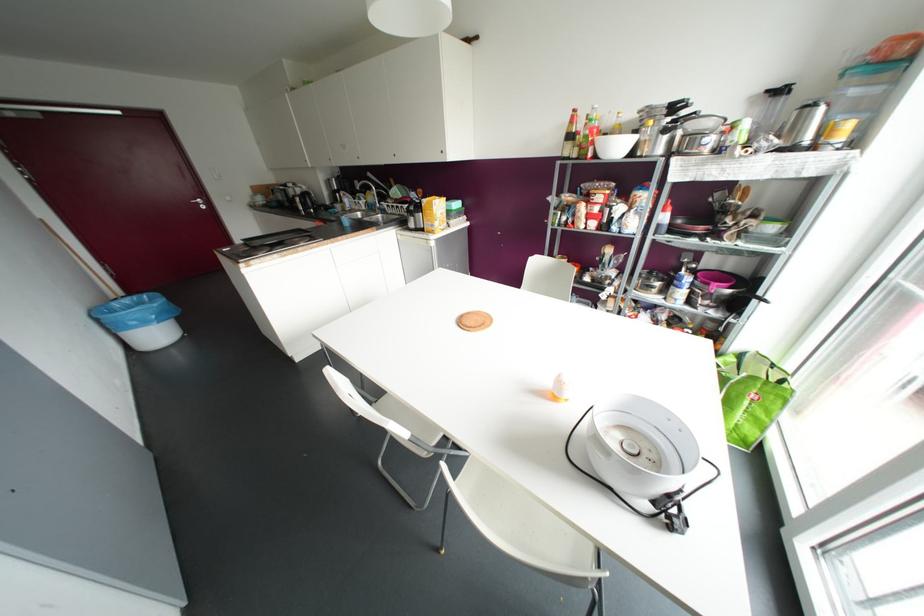
Describe the element at coordinates (512, 507) in the screenshot. The height and width of the screenshot is (616, 924). I see `a chair sitting surface` at that location.